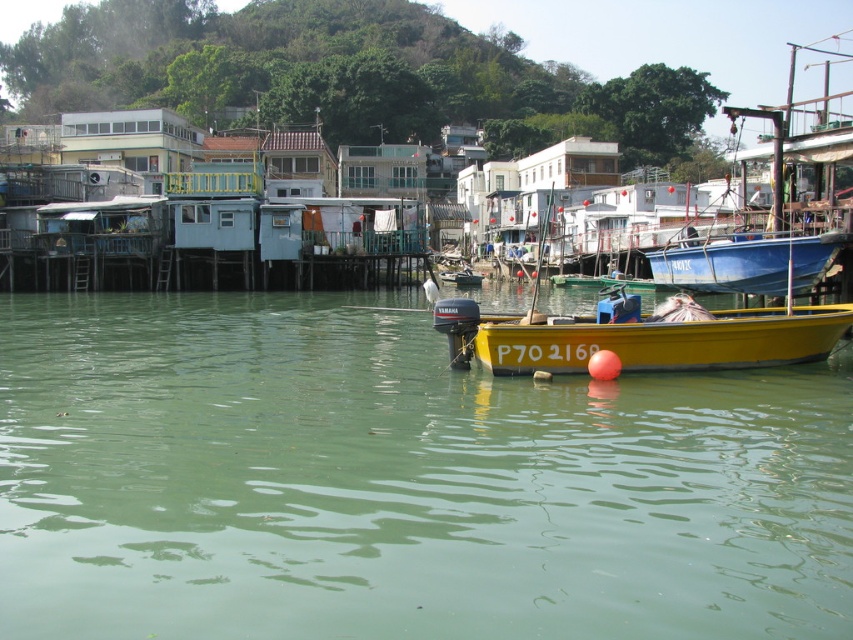
You are a photographer planning to capture a wide shot of the waterfront scene. You want to ensure both the green water at center and the blue matte boat at right are clearly visible in your frame. Given their sizes, which object might you need to adjust your camera angle to accommodate?

The green water at center is thinner than the blue matte boat at right, so you may need to adjust your camera angle to ensure the larger blue matte boat at right doesn t overpower the narrower green water at center in the frame.

You are a marine biologist observing the waterfront scene. You need to choose a boat to measure water quality. The blue matte boat at right can carry more equipment than the yellow matte boat at center. Which boat should you choose?

The blue matte boat at right is larger in size than the yellow matte boat at center, so it can carry more equipment. Therefore, you should choose the blue matte boat at right.